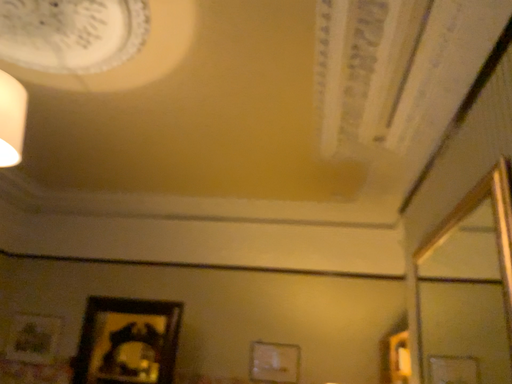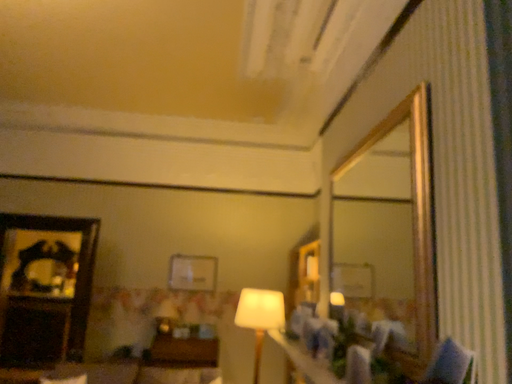
Question: Which way did the camera rotate in the video?

Choices:
 (A) rotated left
 (B) rotated right

Answer: (B)